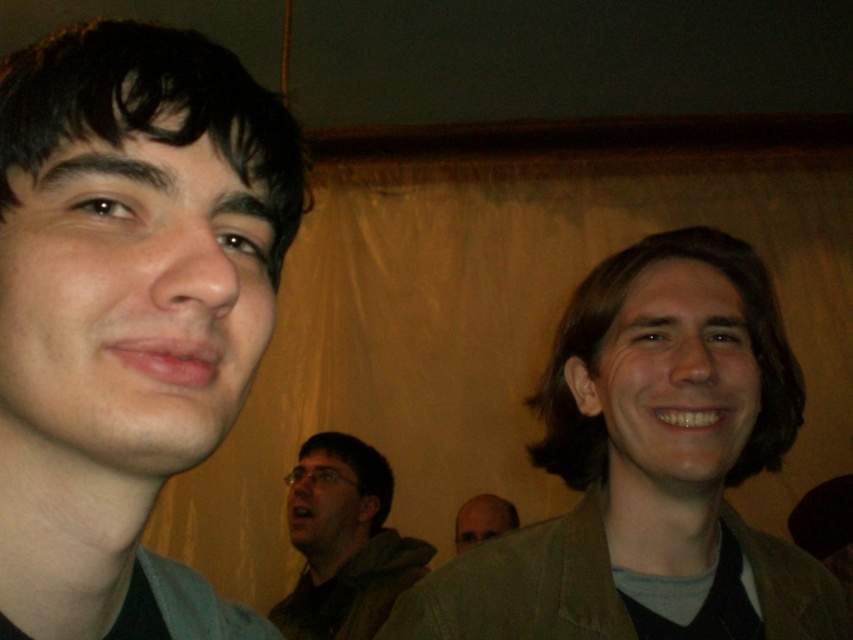
Question: Does green fabric jacket at lower center appear under bald head at center?

Choices:
 (A) yes
 (B) no

Answer: (A)

Question: Where is green fabric jacket at lower center located in relation to bald head at center in the image?

Choices:
 (A) right
 (B) left

Answer: (B)

Question: Can you confirm if green fabric jacket at lower center is positioned to the left of bald head at center?

Choices:
 (A) yes
 (B) no

Answer: (A)